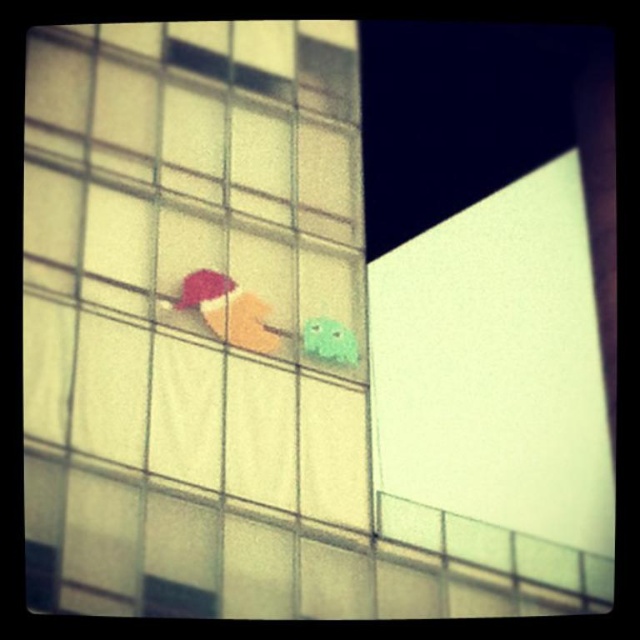
Question: Among these objects, which one is nearest to the camera?

Choices:
 (A) matte plastic ice cream cone at center
 (B) green matte toy at center

Answer: (A)

Question: Does matte plastic ice cream cone at center appear on the left side of green matte toy at center?

Choices:
 (A) no
 (B) yes

Answer: (B)

Question: Can you confirm if matte plastic ice cream cone at center is thinner than green matte toy at center?

Choices:
 (A) no
 (B) yes

Answer: (A)

Question: Among these points, which one is farthest from the camera?

Choices:
 (A) (198, 282)
 (B) (305, 353)

Answer: (B)

Question: Can you confirm if matte plastic ice cream cone at center is positioned to the left of green matte toy at center?

Choices:
 (A) no
 (B) yes

Answer: (B)